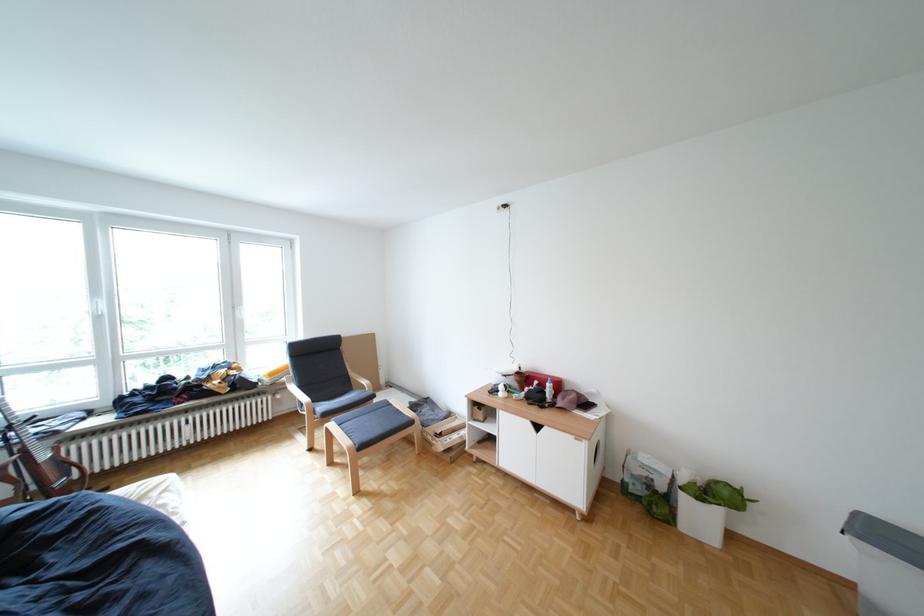
Where would you resting arm the chair armrest? Please return your answer as a coordinate pair (x, y).

(297, 394)